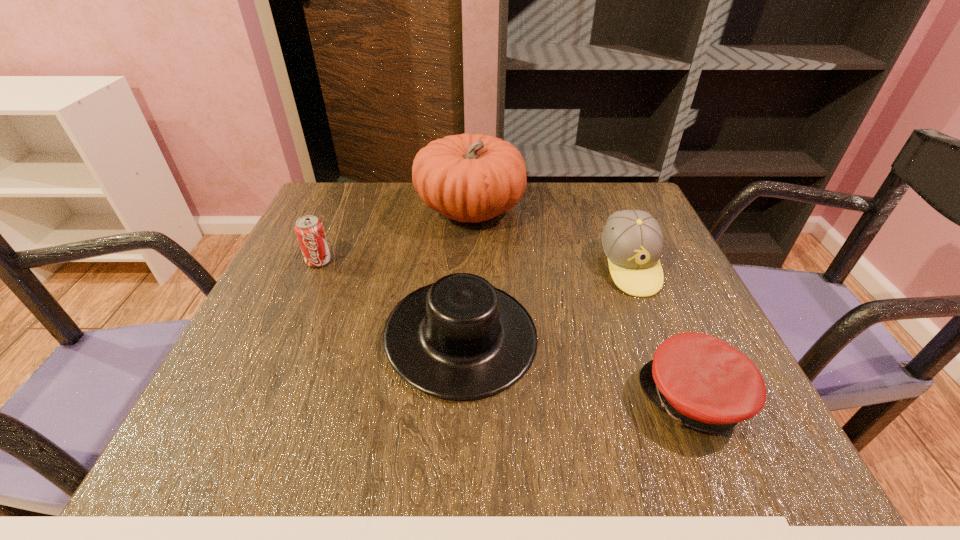
Locate an element on the screen. The height and width of the screenshot is (540, 960). free space between the dress hat and the shortest object is located at coordinates (578, 368).

Locate an element on the screen. Image resolution: width=960 pixels, height=540 pixels. vacant area between the tallest object and the shortest object is located at coordinates (582, 305).

At what (x,y) coordinates should I click in order to perform the action: click on free spot between the cap and the pumpkin. Please return your answer as a coordinate pair (x, y). This screenshot has width=960, height=540. Looking at the image, I should click on (582, 305).

Identify the location of the fourth closest object to the dress hat. The image size is (960, 540). (309, 229).

This screenshot has height=540, width=960. I want to click on object that is the third closest to the soda can, so click(632, 240).

Find the location of a particular element. The image size is (960, 540). vacant space that satisfies the following two spatial constraints: 1. on the front side of the dress hat; 2. on the right side of the soda can is located at coordinates (286, 336).